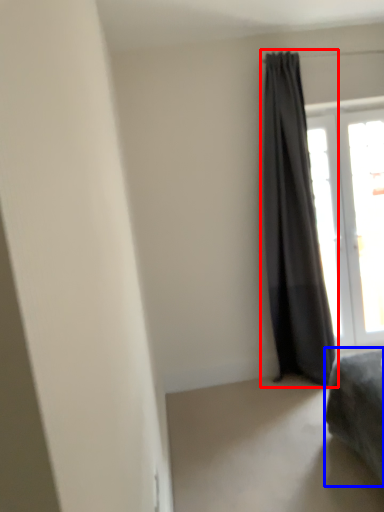
Question: Among these objects, which one is nearest to the camera, curtain (highlighted by a red box) or furniture (highlighted by a blue box)?

Choices:
 (A) curtain
 (B) furniture

Answer: (B)